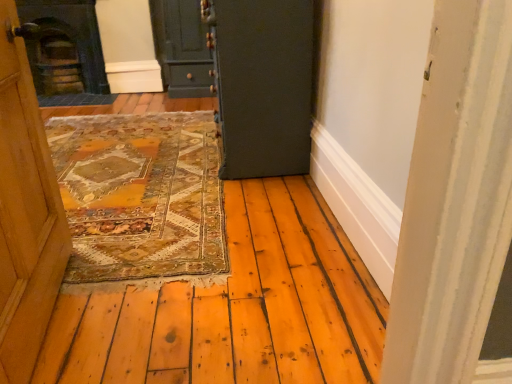
Question: Does point (224, 38) appear closer or farther from the camera than point (90, 79)?

Choices:
 (A) closer
 (B) farther

Answer: (A)

Question: Looking at the image, does dark green wood at center, the second door from the back, seem bigger or smaller compared to dark gray stone fireplace at upper left?

Choices:
 (A) small
 (B) big

Answer: (B)

Question: Estimate the real-world distances between objects in this image. Which object is closer to the dark gray stone fireplace at upper left?

Choices:
 (A) dark green wood at center, acting as the first door starting from the right
 (B) matte dark green cabinet at upper center, acting as the 1th door starting from the back

Answer: (B)

Question: Considering the real-world distances, which object is closest to the matte dark green cabinet at upper center, acting as the 1th door starting from the back?

Choices:
 (A) dark gray stone fireplace at upper left
 (B) dark green wood at center, the second door from the back

Answer: (A)